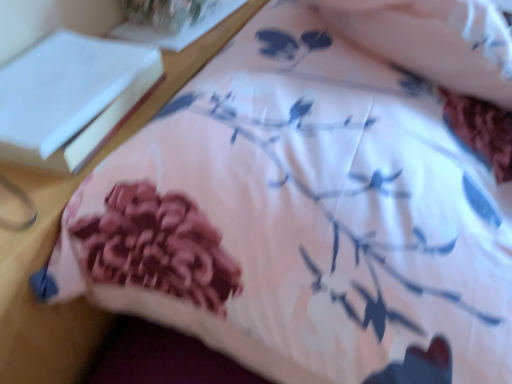
This screenshot has width=512, height=384. What are the coordinates of `free point above white paper at upper left, which appears as the 2th book when viewed from the front (from a real-world perspective)` in the screenshot? It's located at (166, 14).